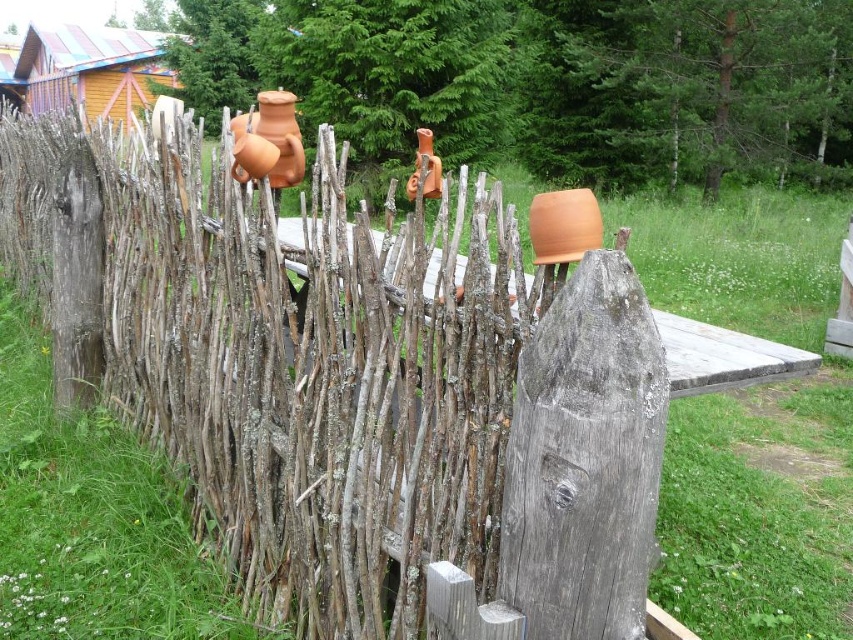
Question: From the image, what is the correct spatial relationship of wooden cabin at upper left in relation to matte clay pot at center?

Choices:
 (A) left
 (B) right

Answer: (A)

Question: Can you confirm if wooden cabin at upper left is positioned to the right of matte clay pot at upper center?

Choices:
 (A) yes
 (B) no

Answer: (B)

Question: Is rustic wooden fence at center above matte clay pot at center?

Choices:
 (A) no
 (B) yes

Answer: (B)

Question: Among these objects, which one is farthest from the camera?

Choices:
 (A) wooden cabin at upper left
 (B) matte clay pot at upper center
 (C) rustic wooden fence at center

Answer: (A)

Question: Among these objects, which one is nearest to the camera?

Choices:
 (A) rustic wooden fence at center
 (B) wooden cabin at upper left

Answer: (A)

Question: Which point is closer to the camera taking this photo?

Choices:
 (A) (33, 104)
 (B) (256, 136)
 (C) (560, 618)
 (D) (550, 225)

Answer: (C)